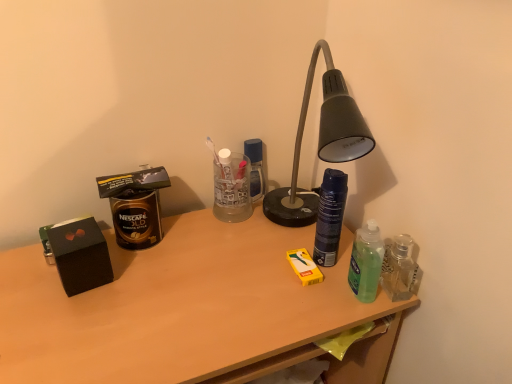
This screenshot has height=384, width=512. What are the coordinates of `vacant space to the left of dark blue matte spray can at center, positioned as the 1th bottle in left-to-right order` in the screenshot? It's located at (246, 260).